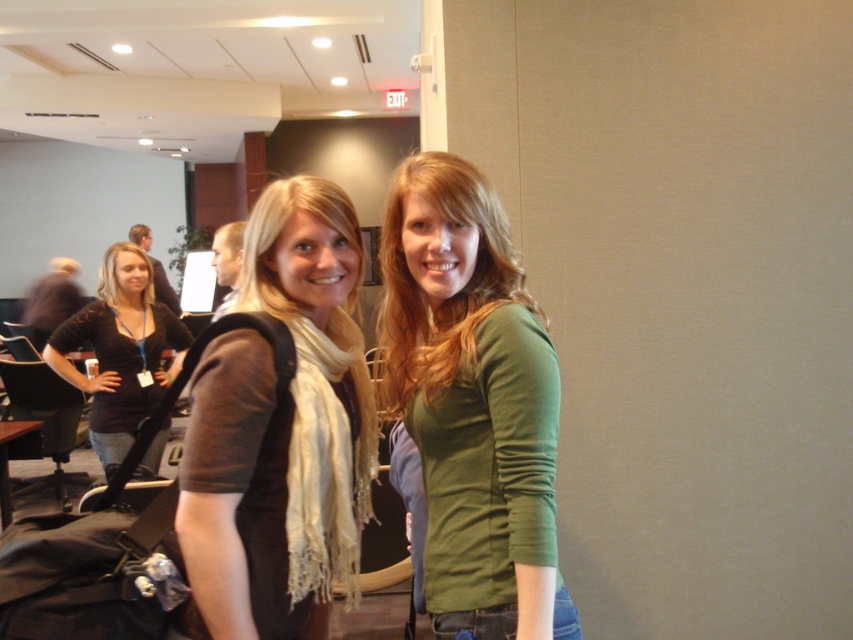
Question: Which point is closer to the camera?

Choices:
 (A) (440, 412)
 (B) (102, 324)
 (C) (253, 564)

Answer: (A)

Question: Does matte brown scarf at center have a lesser width compared to black fabric shirt at left?

Choices:
 (A) no
 (B) yes

Answer: (B)

Question: Can you confirm if matte brown scarf at center is wider than black fabric shirt at left?

Choices:
 (A) no
 (B) yes

Answer: (A)

Question: Is green matte long-sleeve shirt at center positioned in front of black fabric shirt at left?

Choices:
 (A) no
 (B) yes

Answer: (B)

Question: Among these points, which one is farthest from the camera?

Choices:
 (A) (488, 600)
 (B) (293, 630)

Answer: (B)

Question: Which of the following is the farthest from the observer?

Choices:
 (A) coord(115,356)
 (B) coord(456,403)

Answer: (A)